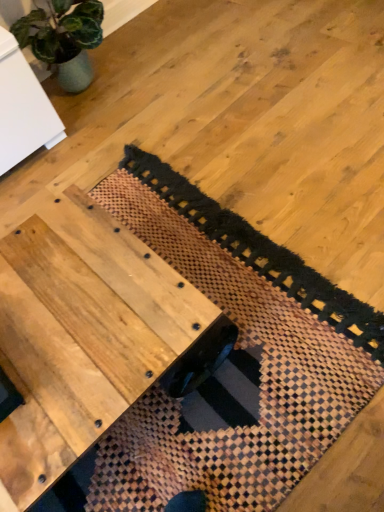
Question: Is wooden woven mat at center to the left or to the right of natural wood table at center in the image?

Choices:
 (A) left
 (B) right

Answer: (B)

Question: Looking at their shapes, would you say wooden woven mat at center is wider or thinner than natural wood table at center?

Choices:
 (A) wide
 (B) thin

Answer: (A)

Question: From a real-world perspective, is wooden woven mat at center above or below natural wood table at center?

Choices:
 (A) below
 (B) above

Answer: (A)

Question: From the image's perspective, relative to wooden woven mat at center, is natural wood table at center above or below?

Choices:
 (A) below
 (B) above

Answer: (A)

Question: Which is correct: natural wood table at center is inside wooden woven mat at center, or outside of it?

Choices:
 (A) inside
 (B) outside

Answer: (B)

Question: From their relative heights in the image, would you say natural wood table at center is taller or shorter than wooden woven mat at center?

Choices:
 (A) tall
 (B) short

Answer: (A)

Question: From a real-world perspective, is natural wood table at center physically located above or below wooden woven mat at center?

Choices:
 (A) above
 (B) below

Answer: (A)